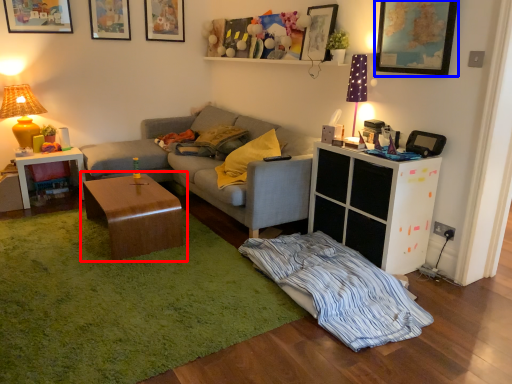
Question: Which object is closer to the camera taking this photo, coffee table (highlighted by a red box) or picture frame (highlighted by a blue box)?

Choices:
 (A) coffee table
 (B) picture frame

Answer: (B)